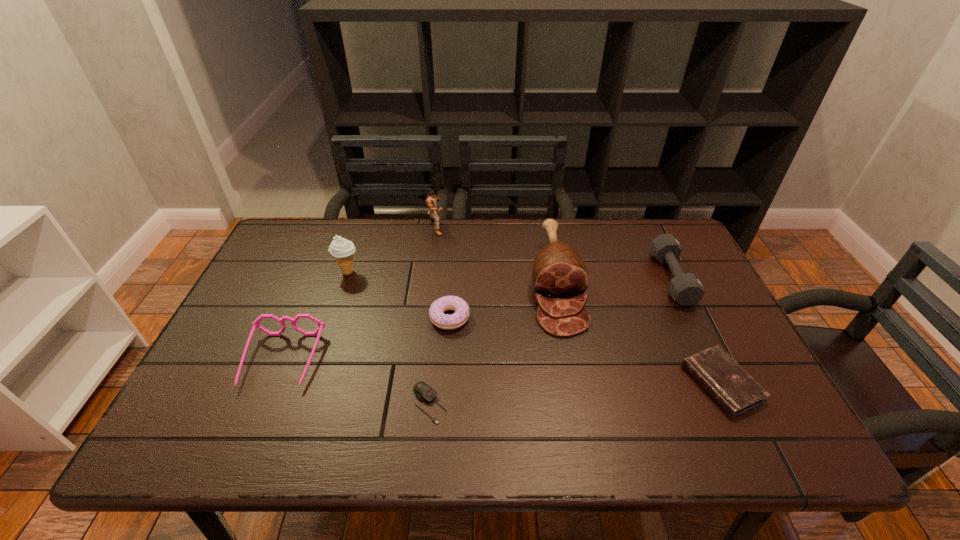
Where is `diary that is at the near edge`? The image size is (960, 540). diary that is at the near edge is located at coordinates (735, 391).

The image size is (960, 540). What are the coordinates of `mouse that is at the near edge` in the screenshot? It's located at point(425,393).

Image resolution: width=960 pixels, height=540 pixels. Find the location of `object present at the left edge`. object present at the left edge is located at coordinates (256, 324).

In order to click on dumbbell that is at the right edge in this screenshot , I will do `click(686, 289)`.

Identify the location of diary at the right edge. (735, 391).

At what (x,y) coordinates should I click in order to perform the action: click on object present at the far right corner. Please return your answer as a coordinate pair (x, y). The width and height of the screenshot is (960, 540). Looking at the image, I should click on (686, 289).

Image resolution: width=960 pixels, height=540 pixels. Find the location of `object located in the near right corner section of the desktop`. object located in the near right corner section of the desktop is located at coordinates (735, 391).

Locate an element on the screen. This screenshot has width=960, height=540. free region at the far edge of the desktop is located at coordinates (625, 238).

The width and height of the screenshot is (960, 540). What are the coordinates of `vacant space at the near edge of the desktop` in the screenshot? It's located at (678, 418).

The image size is (960, 540). In the image, there is a desktop. Find the location of `vacant area at the far left corner`. vacant area at the far left corner is located at coordinates (283, 263).